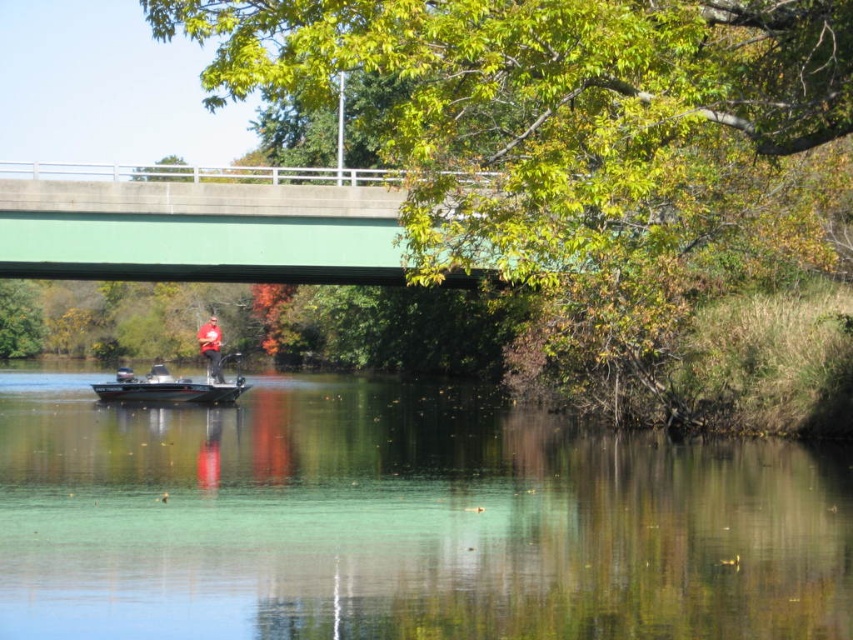
Question: Is green concrete bridge at upper center further to camera compared to red matte shirt at center?

Choices:
 (A) no
 (B) yes

Answer: (A)

Question: Which of the following is the farthest from the observer?

Choices:
 (A) (178, 403)
 (B) (207, 326)
 (C) (107, 259)

Answer: (B)

Question: From the image, what is the correct spatial relationship of clear water at center in relation to metallic gray boat at center?

Choices:
 (A) left
 (B) right

Answer: (B)

Question: Estimate the real-world distances between objects in this image. Which object is farther from the clear water at center?

Choices:
 (A) metallic gray boat at center
 (B) red matte shirt at center

Answer: (B)

Question: Which object appears closest to the camera in this image?

Choices:
 (A) green concrete bridge at upper center
 (B) metallic gray boat at center
 (C) clear water at center

Answer: (C)

Question: Is green concrete bridge at upper center wider than metallic gray boat at center?

Choices:
 (A) yes
 (B) no

Answer: (A)